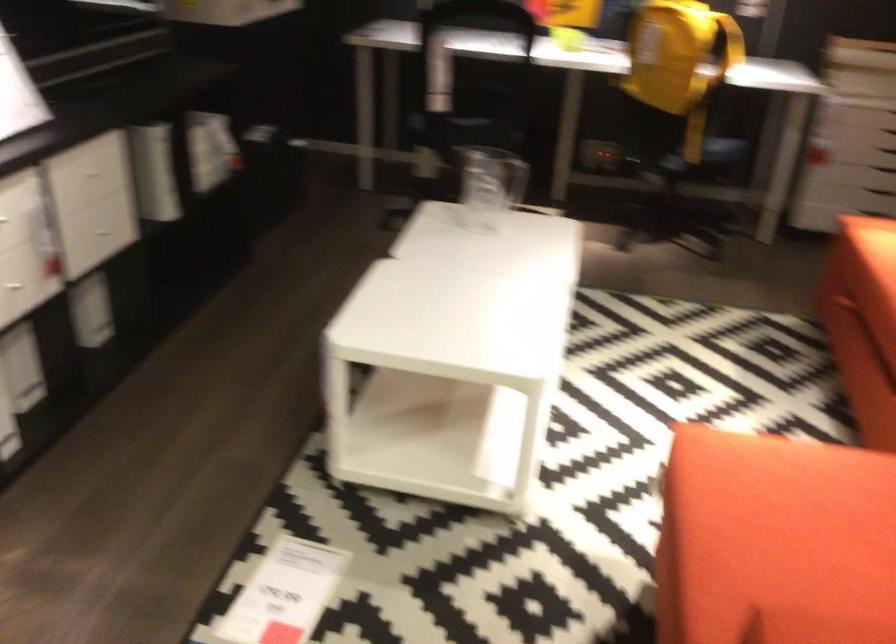
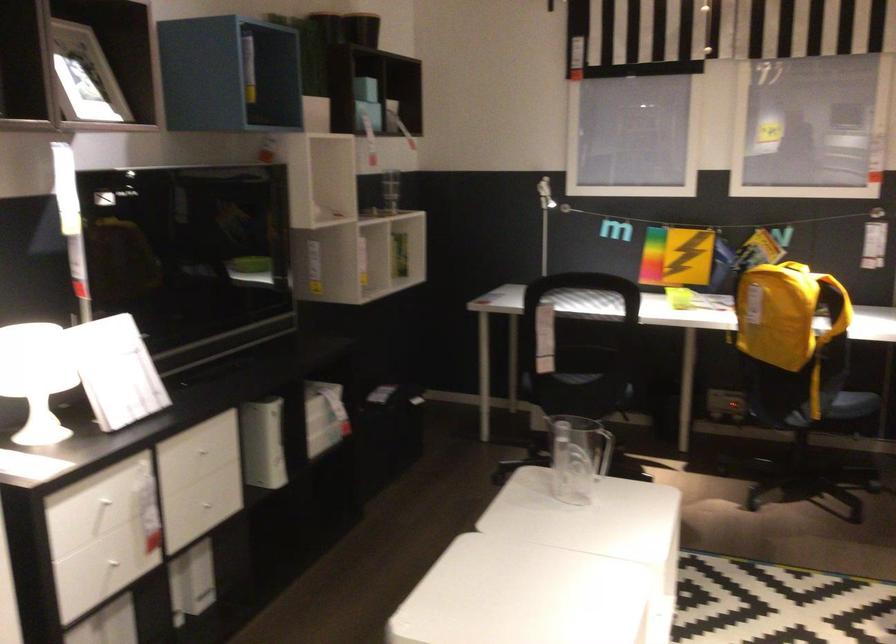
Find the pixel in the second image that matches (455,134) in the first image.

(571, 393)